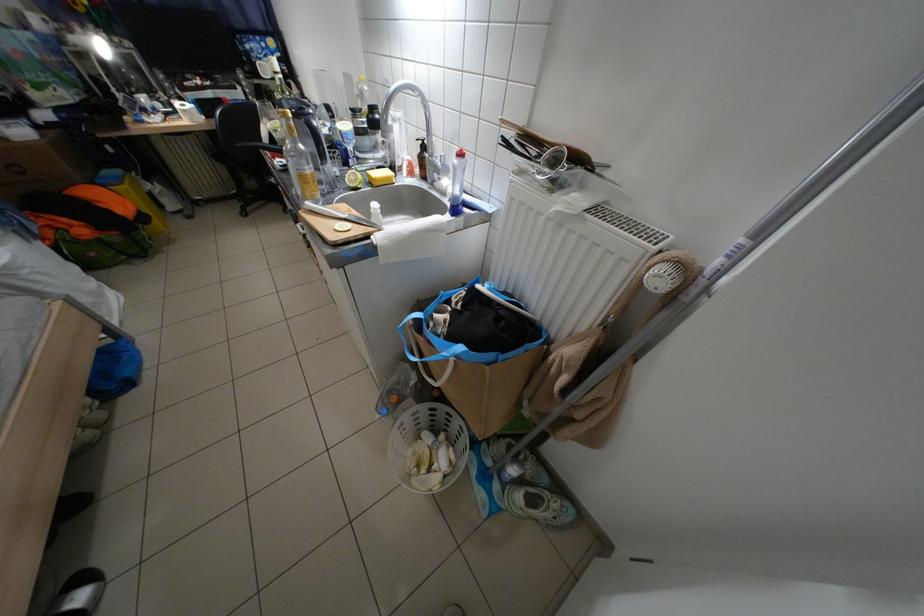
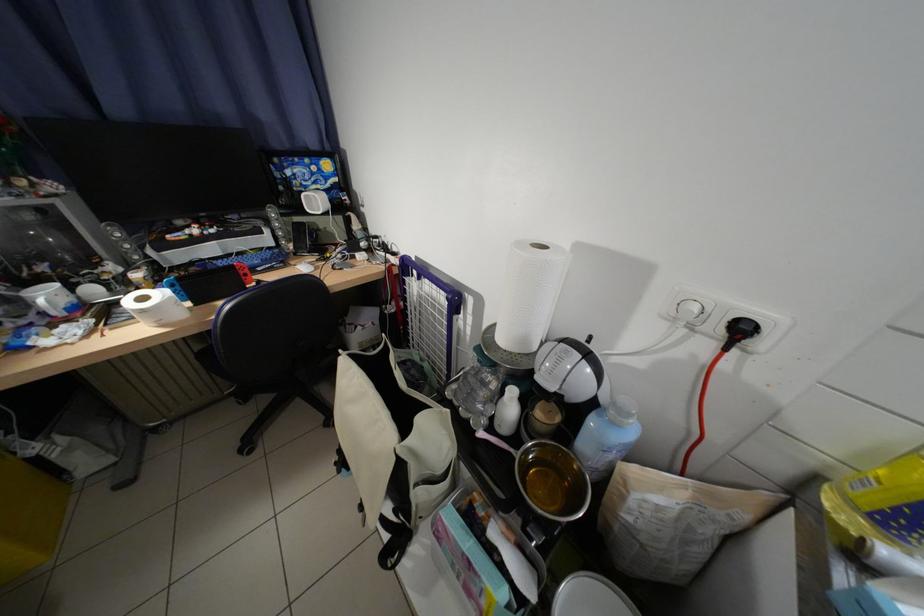
Find the pixel in the second image that matches (x=155, y=100) in the first image.

(59, 297)